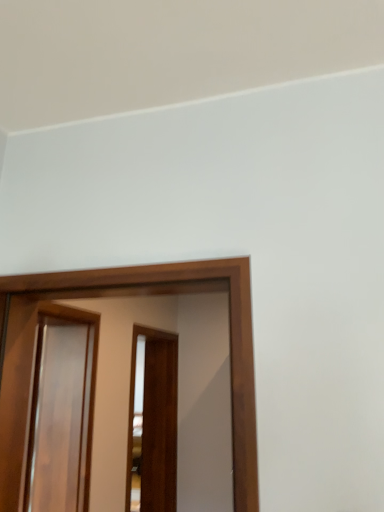
Question: In which direction should I rotate to look at glossy wood screen door at center, the 3th screen door when ordered from back to front?

Choices:
 (A) left
 (B) right

Answer: (A)

Question: From a real-world perspective, is glossy wood screen door at left, which is the second screen door in back-to-front order, over brown wooden screen door at center, positioned as the third screen door in front-to-back order?

Choices:
 (A) no
 (B) yes

Answer: (B)

Question: Considering the relative sizes of glossy wood screen door at left, positioned as the 2th screen door in front-to-back order, and brown wooden screen door at center, positioned as the third screen door in front-to-back order, in the image provided, is glossy wood screen door at left, positioned as the 2th screen door in front-to-back order, bigger than brown wooden screen door at center, positioned as the third screen door in front-to-back order,?

Choices:
 (A) no
 (B) yes

Answer: (A)

Question: Does glossy wood screen door at left, which is the second screen door in back-to-front order, lie behind brown wooden screen door at center, which appears as the 1th screen door when viewed from the back?

Choices:
 (A) yes
 (B) no

Answer: (B)

Question: Can you confirm if glossy wood screen door at left, which is the second screen door in back-to-front order, is positioned to the left of brown wooden screen door at center, positioned as the third screen door in front-to-back order?

Choices:
 (A) no
 (B) yes

Answer: (B)

Question: Does glossy wood screen door at left, which is the second screen door in back-to-front order, have a lesser width compared to brown wooden screen door at center, which appears as the 1th screen door when viewed from the back?

Choices:
 (A) no
 (B) yes

Answer: (A)

Question: Is glossy wood screen door at left, positioned as the 2th screen door in front-to-back order, not within brown wooden screen door at center, positioned as the third screen door in front-to-back order?

Choices:
 (A) yes
 (B) no

Answer: (A)

Question: Can you confirm if glossy wood screen door at center, which appears as the first screen door when viewed from the front, is wider than glossy wood screen door at left, positioned as the 2th screen door in front-to-back order?

Choices:
 (A) no
 (B) yes

Answer: (A)

Question: Does glossy wood screen door at center, the 3th screen door when ordered from back to front, have a larger size compared to glossy wood screen door at left, positioned as the 2th screen door in front-to-back order?

Choices:
 (A) no
 (B) yes

Answer: (A)

Question: Could you tell me if glossy wood screen door at center, which appears as the first screen door when viewed from the front, is turned towards glossy wood screen door at left, positioned as the 2th screen door in front-to-back order?

Choices:
 (A) no
 (B) yes

Answer: (A)

Question: From a real-world perspective, is glossy wood screen door at center, the 3th screen door when ordered from back to front, over glossy wood screen door at left, positioned as the 2th screen door in front-to-back order?

Choices:
 (A) no
 (B) yes

Answer: (B)

Question: Is glossy wood screen door at center, which appears as the first screen door when viewed from the front, at the right side of glossy wood screen door at left, which is the second screen door in back-to-front order?

Choices:
 (A) no
 (B) yes

Answer: (B)

Question: Would you say glossy wood screen door at center, which appears as the first screen door when viewed from the front, is a long distance from glossy wood screen door at left, which is the second screen door in back-to-front order?

Choices:
 (A) no
 (B) yes

Answer: (A)

Question: From a real-world perspective, is glossy wood screen door at center, which appears as the first screen door when viewed from the front, under brown wooden screen door at center, which appears as the 1th screen door when viewed from the back?

Choices:
 (A) yes
 (B) no

Answer: (B)